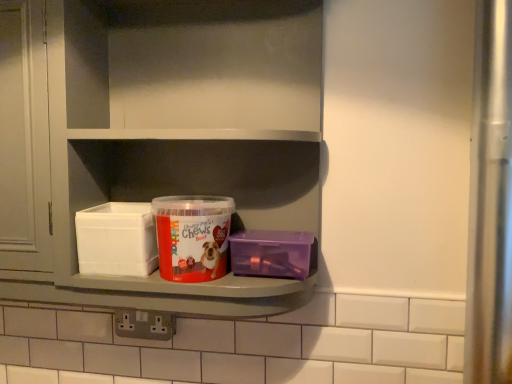
Question: Is the surface of red matte plastic container at center in direct contact with white plastic shelf at center?

Choices:
 (A) yes
 (B) no

Answer: (B)

Question: Considering the relative positions of red matte plastic container at center and white plastic shelf at center in the image provided, is red matte plastic container at center to the right of white plastic shelf at center from the viewer's perspective?

Choices:
 (A) no
 (B) yes

Answer: (A)

Question: Is red matte plastic container at center far from white plastic shelf at center?

Choices:
 (A) yes
 (B) no

Answer: (B)

Question: From the image's perspective, is red matte plastic container at center under white plastic shelf at center?

Choices:
 (A) no
 (B) yes

Answer: (B)

Question: Is red matte plastic container at center looking in the opposite direction of white plastic shelf at center?

Choices:
 (A) yes
 (B) no

Answer: (A)

Question: From the image's perspective, is red matte plastic container at center above white plastic shelf at center?

Choices:
 (A) no
 (B) yes

Answer: (A)

Question: From the image's perspective, would you say white plastic shelf at center is shown under red matte plastic container at center?

Choices:
 (A) yes
 (B) no

Answer: (B)

Question: Is white plastic shelf at center next to red matte plastic container at center?

Choices:
 (A) no
 (B) yes

Answer: (A)

Question: Could red matte plastic container at center be considered to be inside white plastic shelf at center?

Choices:
 (A) yes
 (B) no

Answer: (A)

Question: Is white plastic shelf at center turned away from red matte plastic container at center?

Choices:
 (A) no
 (B) yes

Answer: (B)

Question: Would you consider white plastic shelf at center to be distant from red matte plastic container at center?

Choices:
 (A) no
 (B) yes

Answer: (A)

Question: Can you confirm if white plastic shelf at center is bigger than red matte plastic container at center?

Choices:
 (A) no
 (B) yes

Answer: (B)

Question: Can you confirm if purple plastic container at right is wider than red matte plastic container at center?

Choices:
 (A) no
 (B) yes

Answer: (A)